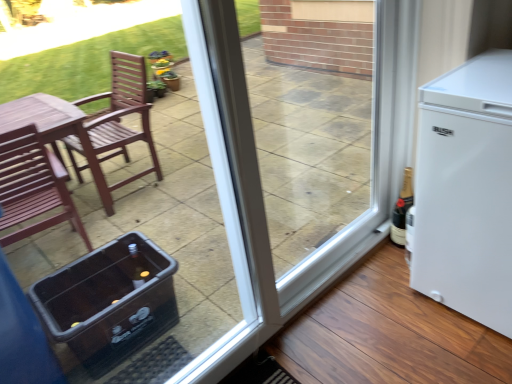
Question: Should I look upward or downward to see transparent plastic cooler at lower left?

Choices:
 (A) up
 (B) down

Answer: (B)

Question: Considering the relative sizes of white matte refrigerator at right and transparent glass screen door at center in the image provided, is white matte refrigerator at right taller than transparent glass screen door at center?

Choices:
 (A) yes
 (B) no

Answer: (B)

Question: From a real-world perspective, is white matte refrigerator at right on transparent glass screen door at center?

Choices:
 (A) no
 (B) yes

Answer: (A)

Question: Considering the relative sizes of white matte refrigerator at right and transparent glass screen door at center in the image provided, is white matte refrigerator at right wider than transparent glass screen door at center?

Choices:
 (A) no
 (B) yes

Answer: (B)

Question: Is white matte refrigerator at right shorter than transparent glass screen door at center?

Choices:
 (A) yes
 (B) no

Answer: (A)

Question: Does white matte refrigerator at right turn towards transparent glass screen door at center?

Choices:
 (A) yes
 (B) no

Answer: (B)

Question: Can you confirm if white matte refrigerator at right is smaller than transparent glass screen door at center?

Choices:
 (A) yes
 (B) no

Answer: (B)

Question: Is white matte refrigerator at right not inside transparent plastic cooler at lower left?

Choices:
 (A) no
 (B) yes

Answer: (B)

Question: Is white matte refrigerator at right oriented away from transparent plastic cooler at lower left?

Choices:
 (A) yes
 (B) no

Answer: (B)

Question: Does white matte refrigerator at right have a lesser width compared to transparent plastic cooler at lower left?

Choices:
 (A) no
 (B) yes

Answer: (A)

Question: From the image's perspective, is white matte refrigerator at right located above transparent plastic cooler at lower left?

Choices:
 (A) no
 (B) yes

Answer: (B)

Question: Can you confirm if white matte refrigerator at right is smaller than transparent plastic cooler at lower left?

Choices:
 (A) yes
 (B) no

Answer: (B)

Question: Is white matte refrigerator at right positioned before transparent plastic cooler at lower left?

Choices:
 (A) no
 (B) yes

Answer: (A)

Question: Considering the relative sizes of transparent glass screen door at center and black glass bottle at right in the image provided, is transparent glass screen door at center bigger than black glass bottle at right?

Choices:
 (A) yes
 (B) no

Answer: (A)